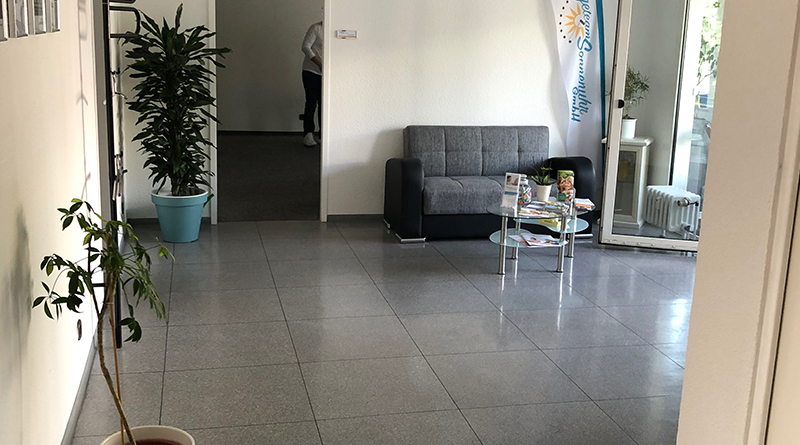
You are a GUI agent. You are given a task and a screenshot of the screen. Output one action in this format:
    pyautogui.click(x=<x>, y=<y>)
    Task: Click on the end of couch
    This screenshot has width=800, height=445.
    Given the screenshot: What is the action you would take?
    pyautogui.click(x=402, y=179), pyautogui.click(x=578, y=170)